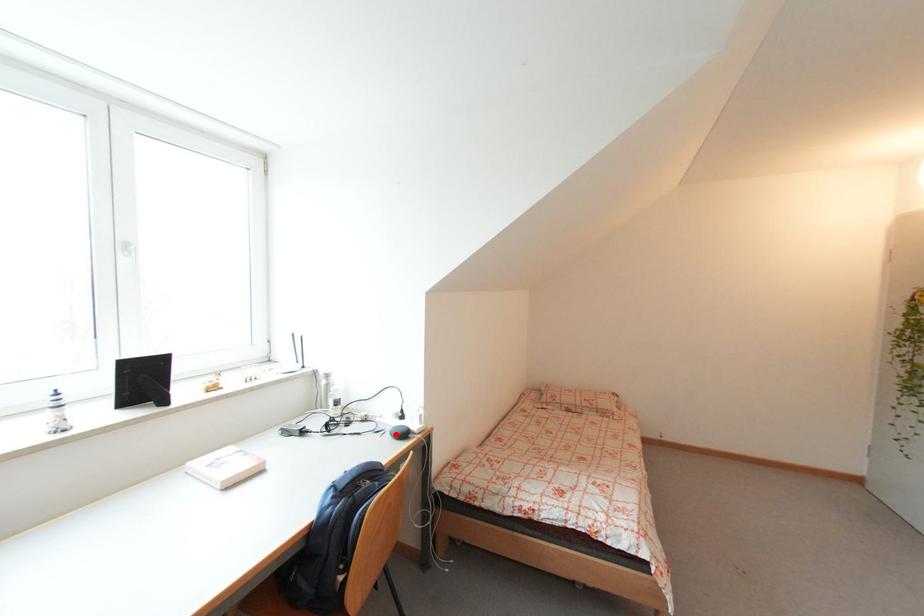
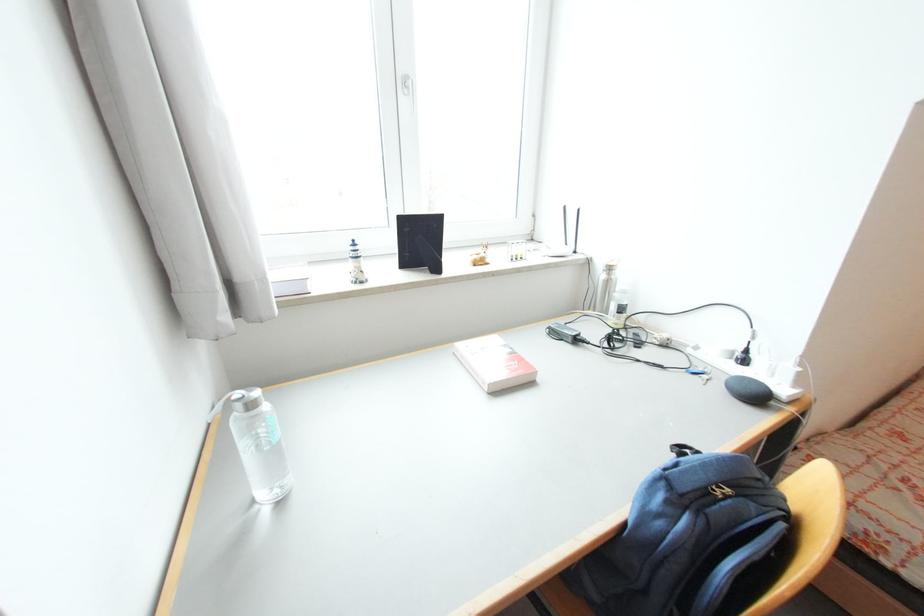
Where in the second image is the point corresponding to the highlighted location from the first image?

(734, 387)